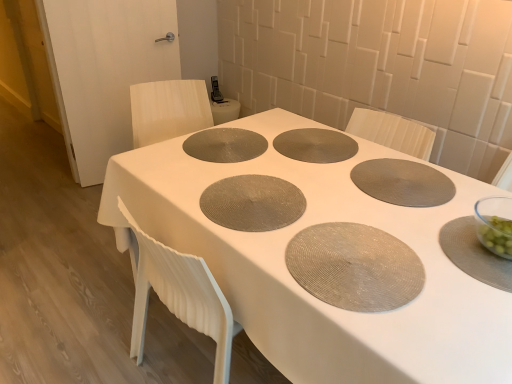
Question: Is matte gray placemat at center, positioned as the second pizza pan in right-to-left order, directly adjacent to matte gray placemat at center?

Choices:
 (A) yes
 (B) no

Answer: (B)

Question: Can you confirm if matte gray placemat at center, positioned as the second pizza pan in right-to-left order, is positioned to the right of matte gray placemat at center?

Choices:
 (A) no
 (B) yes

Answer: (B)

Question: Is matte gray placemat at center, the 2th pizza pan when ordered from left to right, wider than matte gray placemat at center?

Choices:
 (A) yes
 (B) no

Answer: (B)

Question: Does matte gray placemat at center, the 2th pizza pan when ordered from left to right, lie in front of matte gray placemat at center?

Choices:
 (A) no
 (B) yes

Answer: (A)

Question: From the image's perspective, is matte gray placemat at center, positioned as the second pizza pan in right-to-left order, beneath matte gray placemat at center?

Choices:
 (A) no
 (B) yes

Answer: (A)

Question: Based on their sizes in the image, would you say matte gray placemat at center is bigger or smaller than matte gray placemat at center, positioned as the 3th pizza pan in right-to-left order?

Choices:
 (A) big
 (B) small

Answer: (A)

Question: Does point (458, 208) appear closer or farther from the camera than point (266, 190)?

Choices:
 (A) farther
 (B) closer

Answer: (B)

Question: From a real-world perspective, is matte gray placemat at center above or below matte gray placemat at center, positioned as the 3th pizza pan in right-to-left order?

Choices:
 (A) above
 (B) below

Answer: (B)

Question: Would you say matte gray placemat at center is to the left or to the right of matte gray placemat at center, acting as the first pizza pan starting from the left, in the picture?

Choices:
 (A) right
 (B) left

Answer: (A)

Question: Is matte gray placemat at center, acting as the first oval starting from the left, spatially inside matte gray placemat at center, which appears as the first oval when viewed from the right, or outside of it?

Choices:
 (A) outside
 (B) inside

Answer: (A)

Question: Is matte gray placemat at center, which is counted as the second oval, starting from the right, in front of or behind matte gray placemat at center, placed as the 2th oval when sorted from back to front, in the image?

Choices:
 (A) front
 (B) behind

Answer: (B)

Question: Is matte gray placemat at center, acting as the first oval starting from the left, to the left or to the right of matte gray placemat at center, which appears as the first oval when viewed from the right, in the image?

Choices:
 (A) right
 (B) left

Answer: (B)

Question: Is matte gray placemat at center, the 1th oval from the top, bigger or smaller than matte gray placemat at center, placed as the 2th oval when sorted from back to front?

Choices:
 (A) small
 (B) big

Answer: (A)

Question: Visually, is matte gray placemat at center, the second oval in the top-to-bottom sequence, positioned to the left or to the right of matte gray placemat at center, positioned as the 3th pizza pan in right-to-left order?

Choices:
 (A) left
 (B) right

Answer: (B)

Question: From a real-world perspective, is matte gray placemat at center, the second oval when ordered from left to right, positioned above or below matte gray placemat at center, acting as the first pizza pan starting from the left?

Choices:
 (A) above
 (B) below

Answer: (B)